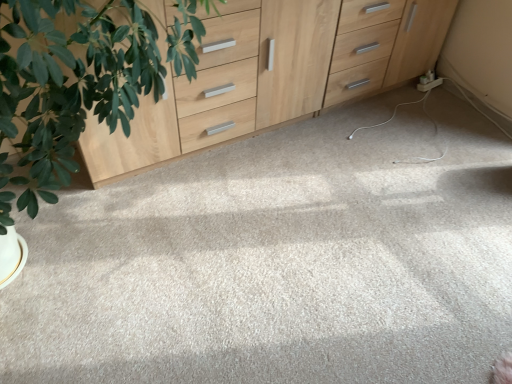
Describe the element at coordinates (275, 73) in the screenshot. The width and height of the screenshot is (512, 384). I see `light wood chest of drawers at upper center` at that location.

The height and width of the screenshot is (384, 512). In order to click on light wood chest of drawers at upper center in this screenshot , I will do point(275,73).

Locate an element on the screen. The image size is (512, 384). light wood chest of drawers at upper center is located at coordinates (275, 73).